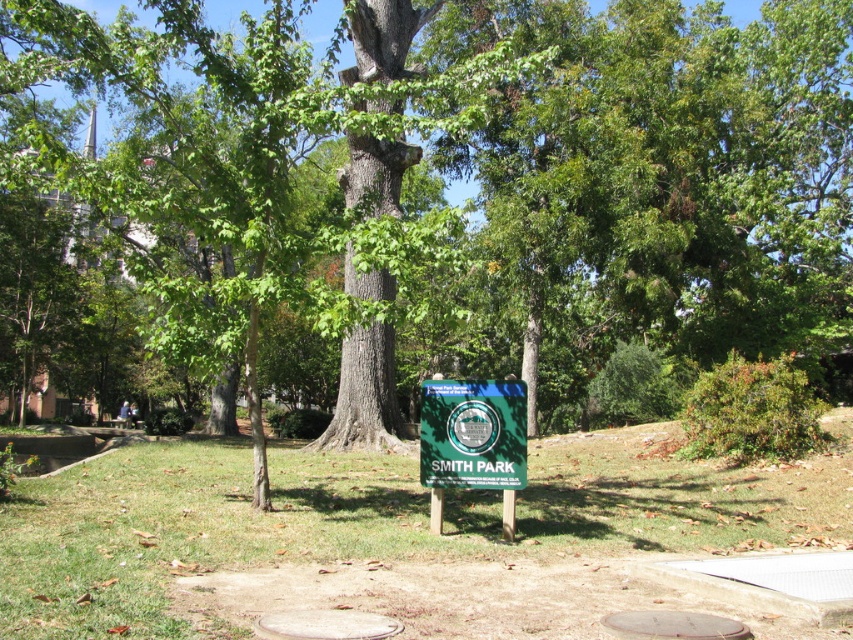
You are standing in Smith Park and want to place a small bench between the green grass at center and the green plastic sign at center. Which object should the bench be placed closer to if you want it to be nearer to the viewer?

The bench should be placed closer to the green grass at center because it is nearer to the viewer compared to the green plastic sign at center.

Based on the photo, you are planning to place a small bench in Smith Park. The bench requires a space wider than the green plastic sign at center. Based on the scene, is the green grass at center a suitable location for placing the bench?

The green grass at center might be wider than the green plastic sign at center, so it could be a suitable location for placing the bench if the required width is met.